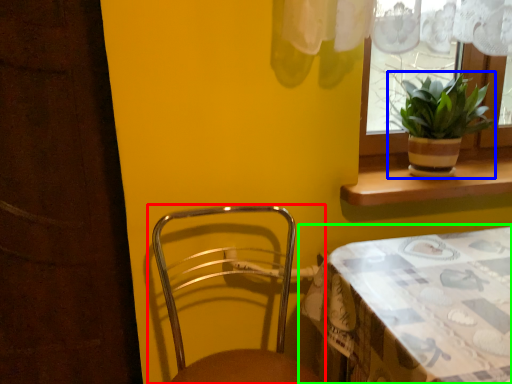
Question: Which is farther away from chair (highlighted by a red box)? houseplant (highlighted by a blue box) or table (highlighted by a green box)?

Choices:
 (A) houseplant
 (B) table

Answer: (A)